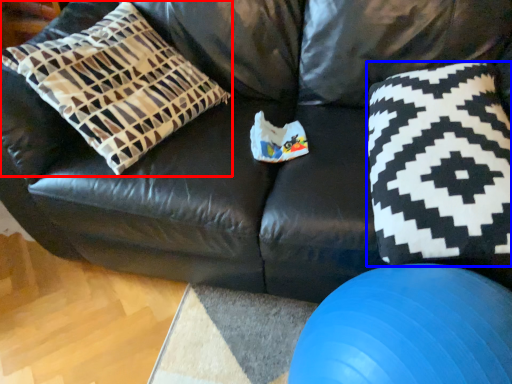
Question: Which of the following is the farthest to the observer, pillow (highlighted by a red box) or throw pillow (highlighted by a blue box)?

Choices:
 (A) pillow
 (B) throw pillow

Answer: (A)